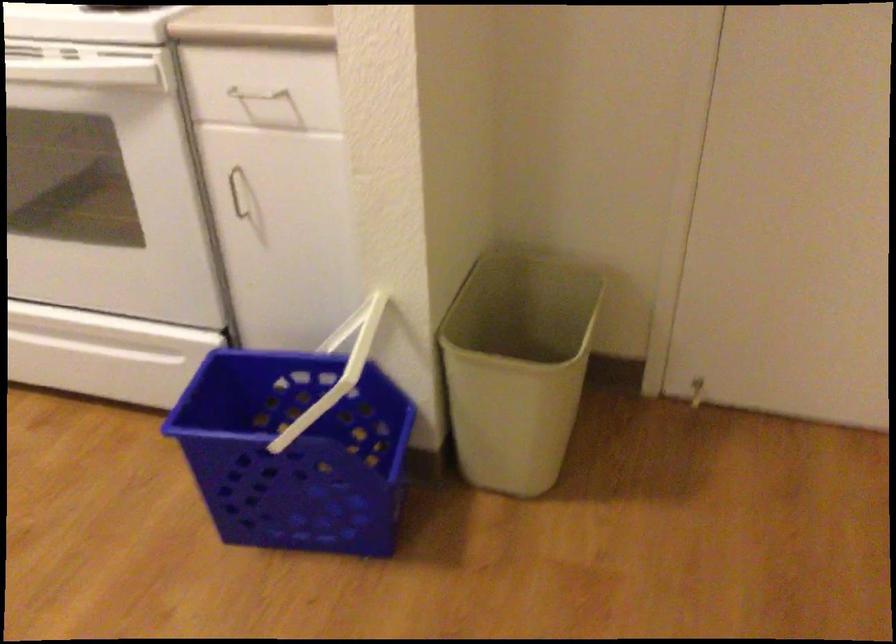
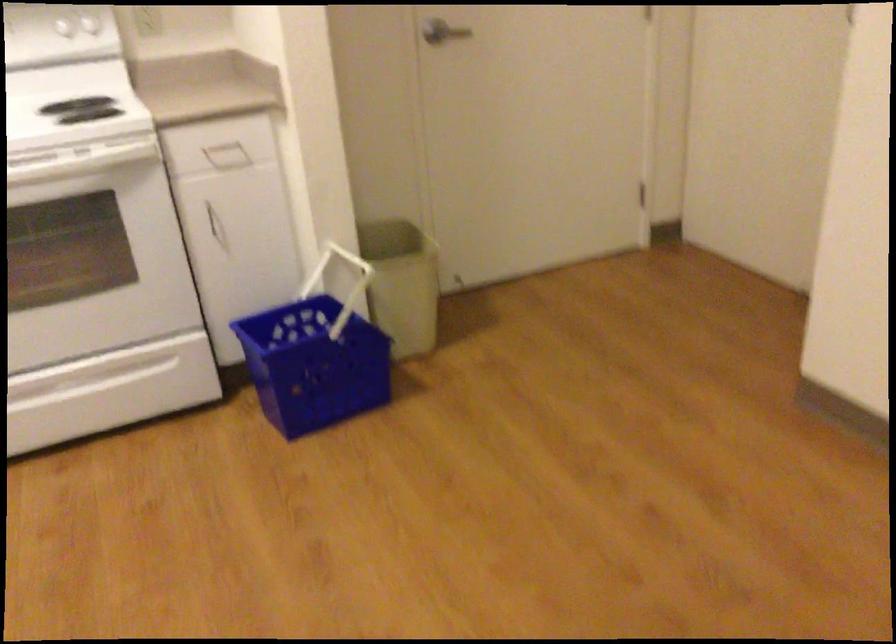
Find the pixel in the second image that matches (x=250, y=210) in the first image.

(216, 225)